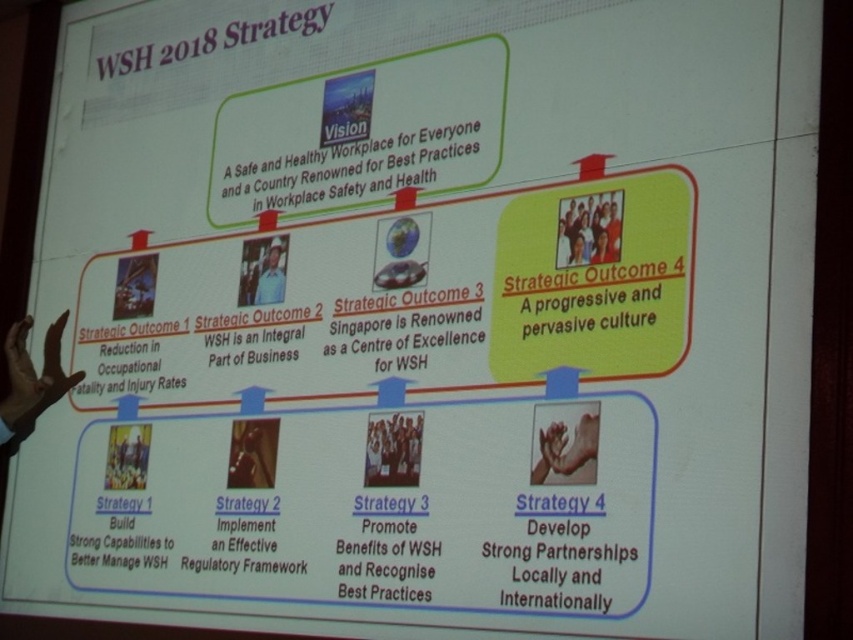
Does dark skin hand at lower left appear under white glossy people at center?

No.

Between dark skin hand at lower left and white glossy people at center, which one has more height?

dark skin hand at lower left is taller.

Who is more distant from viewer, (55, 401) or (393, 465)?

The point (55, 401) is more distant.

At what (x,y) coordinates should I click in order to perform the action: click on dark skin hand at lower left. Please return your answer as a coordinate pair (x, y). The height and width of the screenshot is (640, 853). Looking at the image, I should click on (32, 380).

Between dark skin hand at lower left and white hard hat at center, which one is positioned higher?

white hard hat at center

Image resolution: width=853 pixels, height=640 pixels. Identify the location of dark skin hand at lower left. (32, 380).

Is point (16, 371) positioned after point (578, 209)?

Yes.

Can you confirm if dark skin hand at lower left is wider than yellow fabric group at upper center?

Yes.

Locate an element on the screen. dark skin hand at lower left is located at coordinates (32, 380).